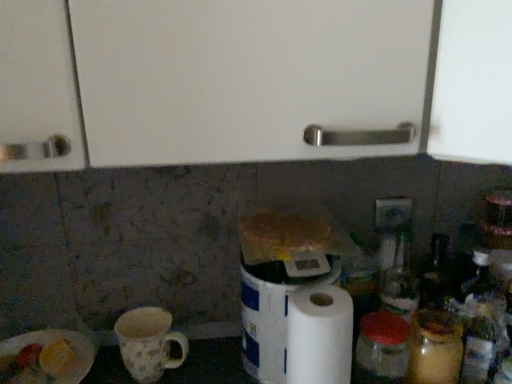
Question: Is white paper towel at center facing away from green plastic electric outlet at upper right?

Choices:
 (A) yes
 (B) no

Answer: (B)

Question: From a real-world perspective, is white paper towel at center physically above green plastic electric outlet at upper right?

Choices:
 (A) yes
 (B) no

Answer: (B)

Question: Could you tell me if white paper towel at center is facing green plastic electric outlet at upper right?

Choices:
 (A) yes
 (B) no

Answer: (B)

Question: Is white paper towel at center not close to green plastic electric outlet at upper right?

Choices:
 (A) yes
 (B) no

Answer: (B)

Question: Is white paper towel at center smaller than green plastic electric outlet at upper right?

Choices:
 (A) no
 (B) yes

Answer: (A)

Question: Does point pos(284,286) appear closer or farther from the camera than point pos(397,210)?

Choices:
 (A) closer
 (B) farther

Answer: (A)

Question: From the image's perspective, relative to green plastic electric outlet at upper right, is white paper towel at center above or below?

Choices:
 (A) above
 (B) below

Answer: (B)

Question: Is white paper towel at center in front of or behind green plastic electric outlet at upper right in the image?

Choices:
 (A) behind
 (B) front

Answer: (B)

Question: Considering the positions of white paper towel at center and green plastic electric outlet at upper right in the image, is white paper towel at center taller or shorter than green plastic electric outlet at upper right?

Choices:
 (A) tall
 (B) short

Answer: (A)

Question: In terms of size, does white matte paper towel at center-right appear bigger or smaller than white paper plate at lower left?

Choices:
 (A) big
 (B) small

Answer: (B)

Question: From a real-world perspective, is white matte paper towel at center-right positioned above or below white paper plate at lower left?

Choices:
 (A) below
 (B) above

Answer: (B)

Question: Considering the positions of point (315, 380) and point (30, 367), is point (315, 380) closer or farther from the camera than point (30, 367)?

Choices:
 (A) farther
 (B) closer

Answer: (B)

Question: Is white matte paper towel at center-right spatially inside white paper plate at lower left, or outside of it?

Choices:
 (A) outside
 (B) inside

Answer: (A)

Question: Is white matte paper towel at center-right taller or shorter than floral ceramic mug at lower left?

Choices:
 (A) short
 (B) tall

Answer: (B)

Question: In terms of width, does white matte paper towel at center-right look wider or thinner when compared to floral ceramic mug at lower left?

Choices:
 (A) wide
 (B) thin

Answer: (B)